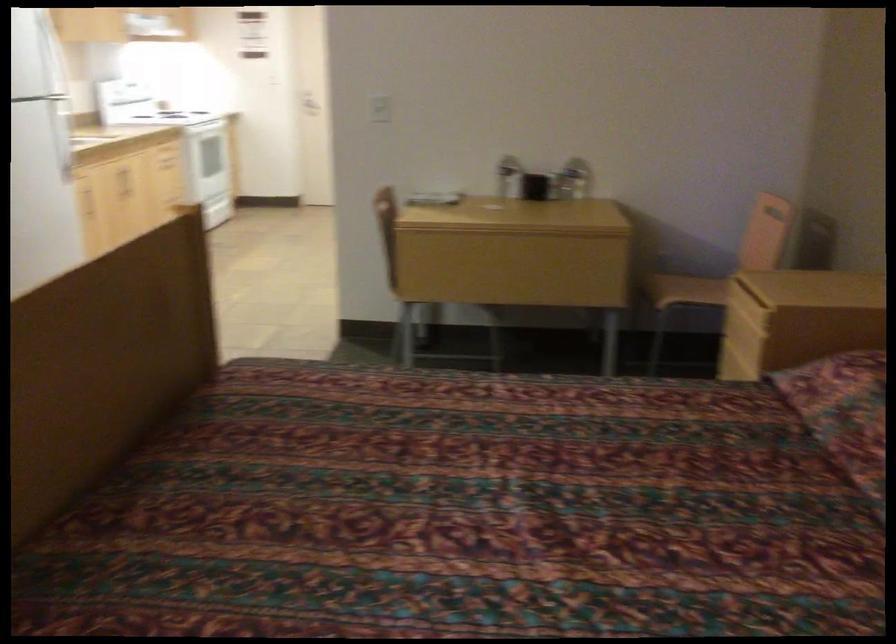
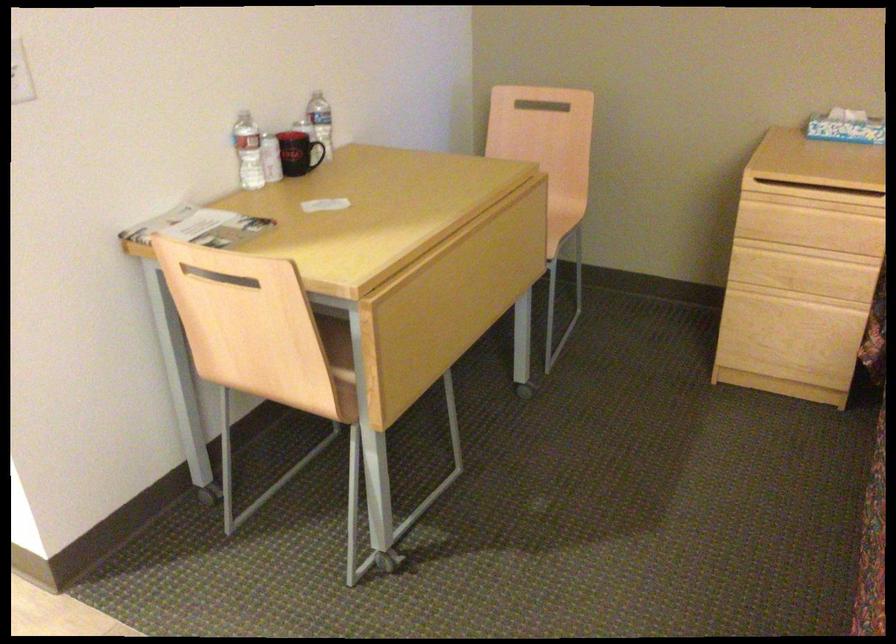
In the second image, find the point that corresponds to point 558,185 in the first image.

(321, 153)